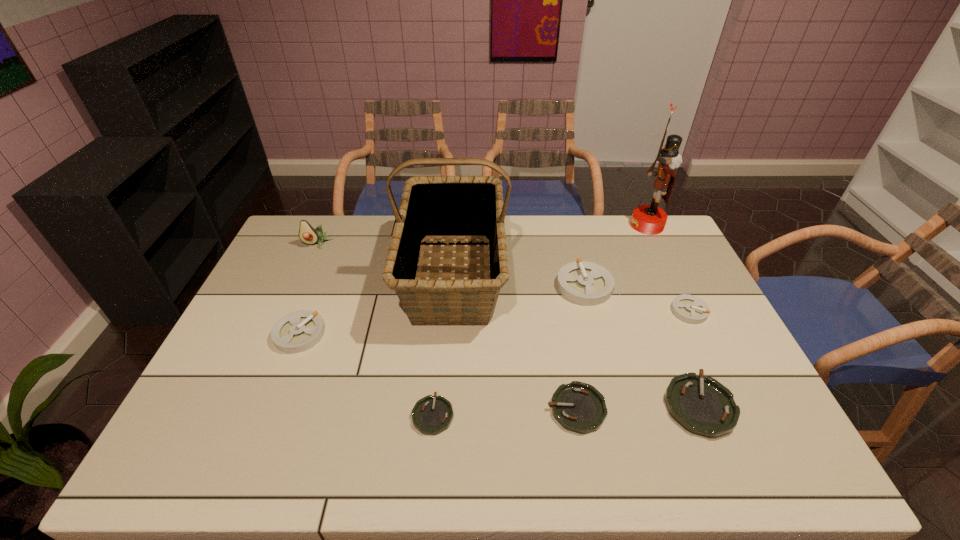
The width and height of the screenshot is (960, 540). I want to click on vacant space located 0.230m on the left of the rightmost gray ashtray, so click(x=596, y=311).

Locate an element on the screen. This screenshot has width=960, height=540. free space located on the right of the second green ashtray from right to left is located at coordinates (633, 409).

At what (x,y) coordinates should I click in order to perform the action: click on blank area located 0.090m on the left of the smallest green ashtray. Please return your answer as a coordinate pair (x, y). Image resolution: width=960 pixels, height=540 pixels. Looking at the image, I should click on (375, 415).

Find the location of a particular element. Image resolution: width=960 pixels, height=540 pixels. nutcracker that is at the far edge is located at coordinates (648, 219).

Locate an element on the screen. The image size is (960, 540). basket at the far edge is located at coordinates 432,207.

The width and height of the screenshot is (960, 540). Find the location of `avocado situated at the far edge`. avocado situated at the far edge is located at coordinates (307, 234).

Where is `object that is positioned at the near edge`? The width and height of the screenshot is (960, 540). object that is positioned at the near edge is located at coordinates (703, 406).

Where is `avocado that is at the left edge`? avocado that is at the left edge is located at coordinates (307, 234).

The width and height of the screenshot is (960, 540). What are the coordinates of `ashtray positioned at the left edge` in the screenshot? It's located at (298, 331).

The height and width of the screenshot is (540, 960). Identify the location of nutcracker located in the right edge section of the desktop. (648, 219).